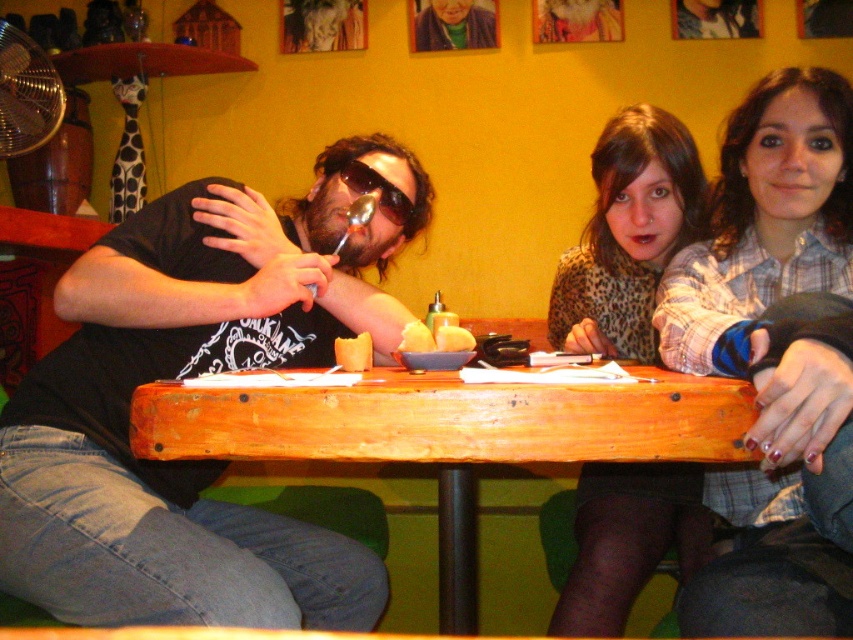
Question: Which point appears closest to the camera in this image?

Choices:
 (A) (386, 180)
 (B) (457, 336)

Answer: (B)

Question: Considering the real-world distances, which object is closest to the wooden table at center?

Choices:
 (A) yellow matte bowl at center
 (B) brushed metal fan at upper left

Answer: (A)

Question: Is wooden table at center positioned at the back of brushed metal fan at upper left?

Choices:
 (A) yes
 (B) no

Answer: (B)

Question: Is wooden table at center to the right of yellow matte butter at center from the viewer's perspective?

Choices:
 (A) yes
 (B) no

Answer: (A)

Question: Does brushed metal fan at upper left appear under orange matte cupcake at center?

Choices:
 (A) yes
 (B) no

Answer: (B)

Question: Among these points, which one is farthest from the camera?

Choices:
 (A) (355, 339)
 (B) (13, 106)
 (C) (776, 472)

Answer: (B)